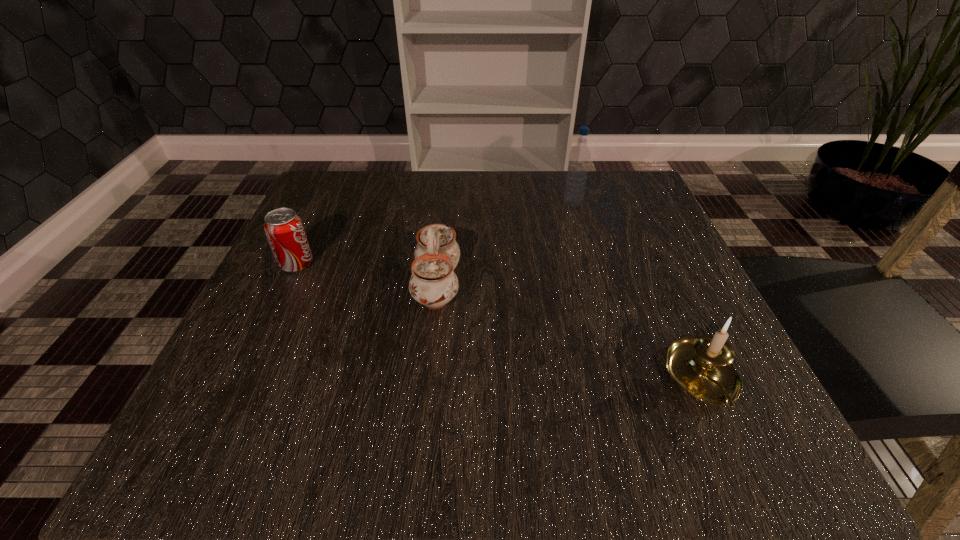
This screenshot has height=540, width=960. In the image, there is a desktop. What are the coordinates of `vacant space at the far left corner` in the screenshot? It's located at (323, 230).

The image size is (960, 540). In order to click on vacant point at the far right corner in this screenshot , I will do `click(591, 184)`.

This screenshot has height=540, width=960. In the image, there is a desktop. In order to click on vacant space at the near right corner in this screenshot , I will do `click(666, 426)`.

Locate an element on the screen. vacant space that's between the second object from left to right and the rightmost object is located at coordinates (570, 332).

The height and width of the screenshot is (540, 960). What are the coordinates of `free space between the water bottle and the candle holder` in the screenshot? It's located at (638, 291).

Where is `empty space that is in between the nearest object and the water bottle`? The height and width of the screenshot is (540, 960). empty space that is in between the nearest object and the water bottle is located at coordinates (638, 291).

Locate an element on the screen. unoccupied area between the second object from left to right and the rightmost object is located at coordinates (570, 332).

Where is `vacant region between the chinaware and the leftmost object`? vacant region between the chinaware and the leftmost object is located at coordinates (367, 274).

Where is `free area in between the third object from right to left and the leftmost object`? This screenshot has width=960, height=540. free area in between the third object from right to left and the leftmost object is located at coordinates (367, 274).

Identify the location of free space between the chinaware and the water bottle. The height and width of the screenshot is (540, 960). (505, 244).